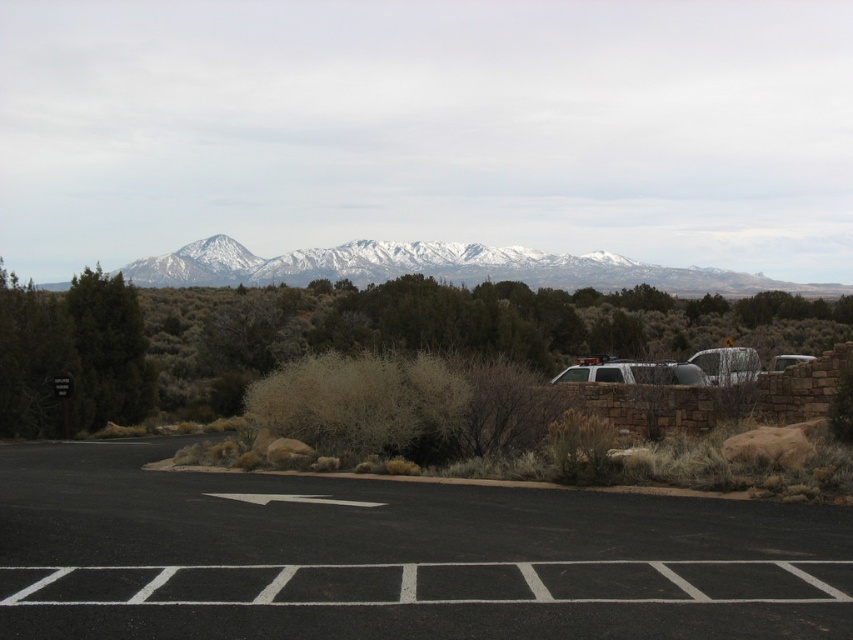
In the scene shown: You are standing at the entrance of the parking area and want to park your car. According to the directional arrow painted on the ground, which points to the right, where should you drive to find an available parking space on the black asphalt parking lot at lower center?

The black asphalt parking lot at lower center is located at point (395, 557), so you should follow the directional arrow pointing right towards the lower center area to find an available parking space.